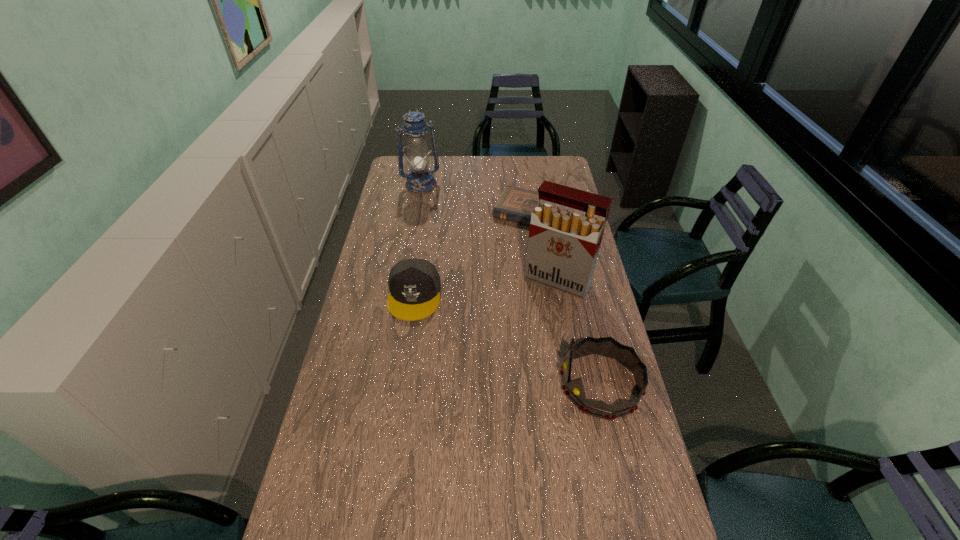
The width and height of the screenshot is (960, 540). Identify the location of free space on the desktop that is between the second shortest object and the third shortest object and is positioned with the lid open on the cigarette case. (521, 347).

The height and width of the screenshot is (540, 960). I want to click on vacant spot on the desktop that is between the cap and the third shortest object and is positioned on the front-facing side of the farthest object, so click(x=492, y=333).

The width and height of the screenshot is (960, 540). What are the coordinates of `vacant space on the desktop that is between the fourth tallest object and the third tallest object and is positioned on the spine side of the Bible` in the screenshot? It's located at (478, 326).